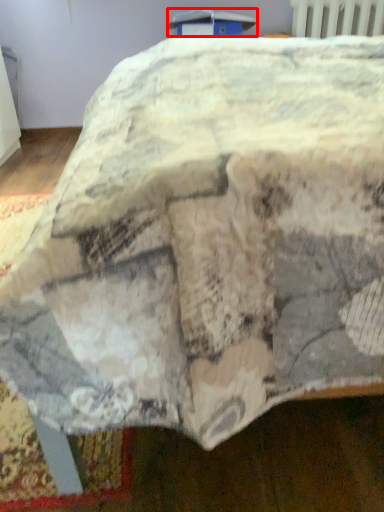
Question: Observing the image, what is the correct spatial positioning of table (annotated by the red box) in reference to radiator?

Choices:
 (A) left
 (B) right

Answer: (A)